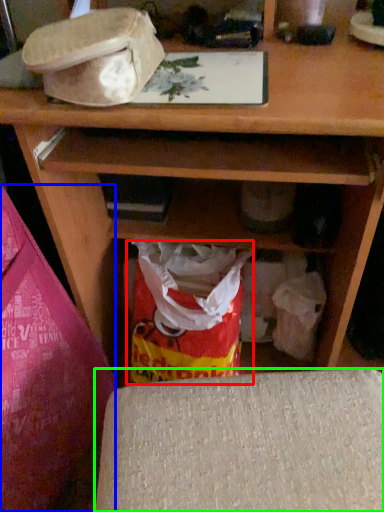
Question: Based on their relative distances, which object is farther from grocery bag (highlighted by a red box)? Choose from leftover (highlighted by a blue box) and furniture (highlighted by a green box).

Choices:
 (A) leftover
 (B) furniture

Answer: (B)